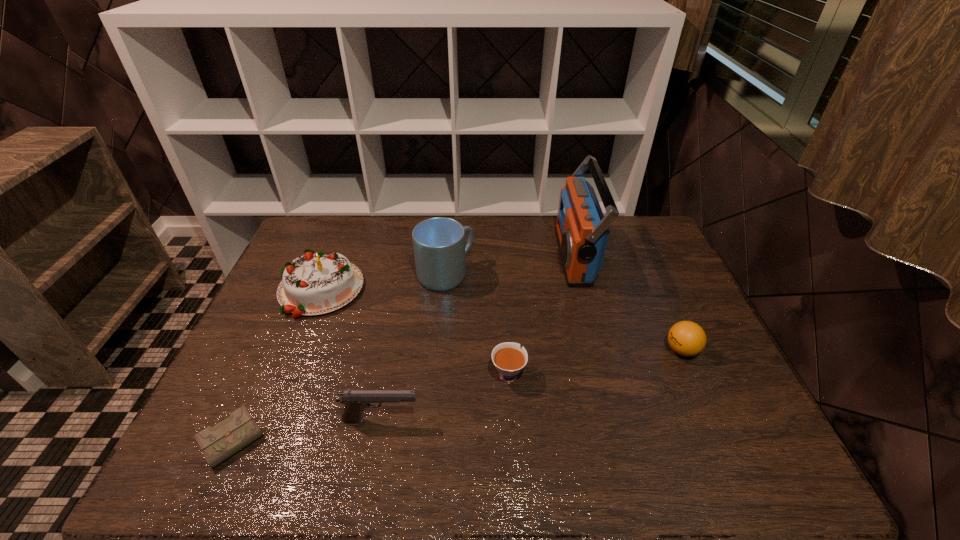
Find the location of `radio receiver`. radio receiver is located at coordinates (582, 231).

This screenshot has width=960, height=540. Identify the location of the second object from right to left. (582, 231).

Where is `mug`? This screenshot has width=960, height=540. mug is located at coordinates (439, 247).

Where is `the fifth shortest object`? The image size is (960, 540). the fifth shortest object is located at coordinates (314, 284).

The height and width of the screenshot is (540, 960). I want to click on the fourth tallest object, so (355, 401).

This screenshot has height=540, width=960. Find the location of `the third shortest object`. the third shortest object is located at coordinates (686, 338).

The image size is (960, 540). I want to click on the rightmost object, so click(686, 338).

The height and width of the screenshot is (540, 960). What are the coordinates of `the fifth object from left to right` in the screenshot? It's located at (509, 359).

In order to click on the sixth tallest object in this screenshot , I will do `click(509, 359)`.

Where is `the shortest object`? Image resolution: width=960 pixels, height=540 pixels. the shortest object is located at coordinates (218, 443).